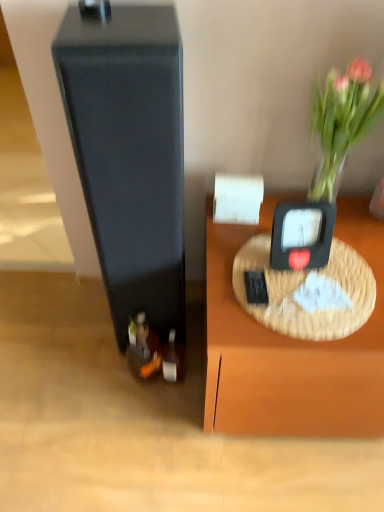
The height and width of the screenshot is (512, 384). What do you see at coordinates (302, 234) in the screenshot?
I see `black plastic weight scale at upper right` at bounding box center [302, 234].

What do you see at coordinates (342, 123) in the screenshot? The width and height of the screenshot is (384, 512). I see `translucent glass vase at upper right` at bounding box center [342, 123].

The width and height of the screenshot is (384, 512). I want to click on shiny dark glass wine bottle at lower left, the 1th wine bottle viewed from the left, so click(143, 348).

From a real-world perspective, is black plastic weight scale at upper right located higher than translucent glass vase at upper right?

No, from a real-world perspective, black plastic weight scale at upper right is not on top of translucent glass vase at upper right.

Considering the sizes of objects black plastic weight scale at upper right and translucent glass vase at upper right in the image provided, who is bigger, black plastic weight scale at upper right or translucent glass vase at upper right?

With larger size is translucent glass vase at upper right.

In the scene shown: Who is shorter, black plastic weight scale at upper right or translucent glass vase at upper right?

With less height is black plastic weight scale at upper right.

Which object is further away from the camera taking this photo, black plastic weight scale at upper right or translucent glass vase at upper right?

black plastic weight scale at upper right is further away from the camera.

Which is more to the right, translucent glass vase at upper right or shiny dark glass wine bottle at lower left, which is the 2th wine bottle from right to left?

translucent glass vase at upper right.

Can you confirm if translucent glass vase at upper right is bigger than shiny dark glass wine bottle at lower left, which is the 2th wine bottle from right to left?

Yes, translucent glass vase at upper right is bigger than shiny dark glass wine bottle at lower left, which is the 2th wine bottle from right to left.

Is translucent glass vase at upper right not inside shiny dark glass wine bottle at lower left, the 1th wine bottle viewed from the left?

Yes.

Looking at their sizes, would you say translucent glass vase at upper right is wider or thinner than shiny dark glass wine bottle at lower left, the 1th wine bottle viewed from the left?

In the image, translucent glass vase at upper right appears to be wider than shiny dark glass wine bottle at lower left, the 1th wine bottle viewed from the left.

Could you tell me if translucent glass vase at upper right is facing black plastic weight scale at upper right?

No, translucent glass vase at upper right is not turned towards black plastic weight scale at upper right.

Which is more to the right, translucent glass vase at upper right or black plastic weight scale at upper right?

translucent glass vase at upper right.

Does point (335, 86) come closer to viewer compared to point (328, 221)?

Yes, point (335, 86) is closer to viewer.

Is translucent glass vase at upper right thinner than black plastic weight scale at upper right?

No, translucent glass vase at upper right is not thinner than black plastic weight scale at upper right.

Based on their sizes in the image, would you say matte black speaker at left is bigger or smaller than black plastic weight scale at upper right?

Clearly, matte black speaker at left is larger in size than black plastic weight scale at upper right.

Is point (67, 109) in front of point (271, 256)?

Yes.

Is matte black speaker at left taller or shorter than black plastic weight scale at upper right?

matte black speaker at left is taller than black plastic weight scale at upper right.

Are matte black speaker at left and translucent glass vase at upper right making contact?

No, matte black speaker at left is not with translucent glass vase at upper right.

Find the location of a particular element. The image size is (384, 512). wide below the translucent glass vase at upper right (from the image's perspective) is located at coordinates (129, 154).

Is matte black speaker at left oriented towards translucent glass vase at upper right?

No.

From a real-world perspective, is translucent glass vase at upper right positioned above or below matte black speaker at left?

From a real-world perspective, translucent glass vase at upper right is physically above matte black speaker at left.

Are translucent glass vase at upper right and matte black speaker at left far apart?

No, translucent glass vase at upper right is not far from matte black speaker at left.

Is translucent glass vase at upper right positioned with its back to matte black speaker at left?

No, translucent glass vase at upper right's orientation is not away from matte black speaker at left.

What's the angular difference between translucent glass vase at upper right and matte black speaker at left's facing directions?

2.15 degrees separate the facing orientations of translucent glass vase at upper right and matte black speaker at left.

Which of these two, shiny dark glass wine bottle at lower left, the 1th wine bottle viewed from the left, or translucent glass vase at upper right, is thinner?

shiny dark glass wine bottle at lower left, the 1th wine bottle viewed from the left, is thinner.

Which is in front, shiny dark glass wine bottle at lower left, the 1th wine bottle viewed from the left, or translucent glass vase at upper right?

translucent glass vase at upper right is in front.

From the image's perspective, relative to translucent glass vase at upper right, is shiny dark glass wine bottle at lower left, the 1th wine bottle viewed from the left, above or below?

Clearly, from the image's perspective, shiny dark glass wine bottle at lower left, the 1th wine bottle viewed from the left, is below translucent glass vase at upper right.

In order to click on weight scale below the translucent glass vase at upper right (from a real-world perspective) in this screenshot , I will do `click(302, 234)`.

Locate an element on the screen. Image resolution: width=384 pixels, height=512 pixels. plant located above the shiny dark glass wine bottle at lower left, which is the 2th wine bottle from right to left (from the image's perspective) is located at coordinates (342, 123).

Which object lies nearer to the anchor point shiny dark glass wine bottle at lower left, the 1th wine bottle viewed from the left, black plastic weight scale at upper right or matte black speaker at left?

matte black speaker at left is closer to shiny dark glass wine bottle at lower left, the 1th wine bottle viewed from the left.

Considering their positions, is matte black speaker at left positioned further to black plastic weight scale at upper right than shiny silver wine bottle at lower center, which is the second wine bottle in left-to-right order?

shiny silver wine bottle at lower center, which is the second wine bottle in left-to-right order, lies further to black plastic weight scale at upper right than the other object.

Which object lies further to the anchor point translucent glass vase at upper right, shiny silver wine bottle at lower center, which is the second wine bottle in left-to-right order, or matte black speaker at left?

shiny silver wine bottle at lower center, which is the second wine bottle in left-to-right order, is further to translucent glass vase at upper right.

Consider the image. Which object lies further to the anchor point shiny dark glass wine bottle at lower left, the 1th wine bottle viewed from the left, translucent glass vase at upper right or shiny silver wine bottle at lower center, marked as the 1th wine bottle in a right-to-left arrangement?

Based on the image, translucent glass vase at upper right appears to be further to shiny dark glass wine bottle at lower left, the 1th wine bottle viewed from the left.

Estimate the real-world distances between objects in this image. Which object is closer to matte black speaker at left, translucent glass vase at upper right or black plastic weight scale at upper right?

black plastic weight scale at upper right is closer to matte black speaker at left.

When comparing their distances from shiny silver wine bottle at lower center, marked as the 1th wine bottle in a right-to-left arrangement, does matte black speaker at left or black plastic weight scale at upper right seem closer?

Among the two, matte black speaker at left is located nearer to shiny silver wine bottle at lower center, marked as the 1th wine bottle in a right-to-left arrangement.

Which object lies nearer to the anchor point matte black speaker at left, shiny dark glass wine bottle at lower left, which is the 2th wine bottle from right to left, or translucent glass vase at upper right?

shiny dark glass wine bottle at lower left, which is the 2th wine bottle from right to left.

Considering their positions, is shiny dark glass wine bottle at lower left, which is the 2th wine bottle from right to left, positioned closer to black plastic weight scale at upper right than matte black speaker at left?

The object closer to black plastic weight scale at upper right is matte black speaker at left.

This screenshot has height=512, width=384. Identify the location of weight scale located between matte black speaker at left and shiny silver wine bottle at lower center, marked as the 1th wine bottle in a right-to-left arrangement, in the depth direction. (302, 234).

Find the location of `wide between translucent glass vase at upper right and shiny dark glass wine bottle at lower left, the 1th wine bottle viewed from the left, vertically`. wide between translucent glass vase at upper right and shiny dark glass wine bottle at lower left, the 1th wine bottle viewed from the left, vertically is located at coordinates (129, 154).

Identify the location of wide that lies between translucent glass vase at upper right and shiny silver wine bottle at lower center, which is the second wine bottle in left-to-right order, from top to bottom. This screenshot has height=512, width=384. (129, 154).

Identify the location of weight scale positioned between matte black speaker at left and shiny dark glass wine bottle at lower left, which is the 2th wine bottle from right to left, from near to far. (302, 234).